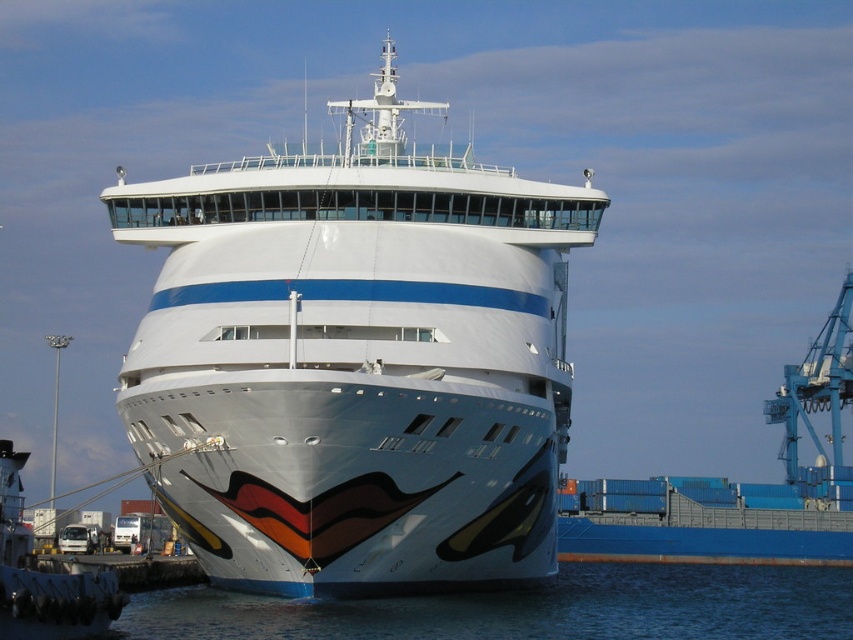
Question: Among these objects, which one is farthest from the camera?

Choices:
 (A) blue water at lower center
 (B) white glossy cruise ship at center

Answer: (A)

Question: Which point is closer to the camera?

Choices:
 (A) (553, 476)
 (B) (103, 593)
 (C) (527, 605)

Answer: (B)

Question: Can you confirm if white glossy cruise ship at center is positioned below blue water at lower center?

Choices:
 (A) yes
 (B) no

Answer: (B)

Question: Does white glossy cruise ship at center have a lesser width compared to white glossy ship at center?

Choices:
 (A) no
 (B) yes

Answer: (A)

Question: Can you confirm if white glossy cruise ship at center is thinner than blue water at lower center?

Choices:
 (A) yes
 (B) no

Answer: (A)

Question: Based on their relative distances, which object is nearer to the white glossy ship at center?

Choices:
 (A) white glossy cruise ship at center
 (B) blue water at lower center

Answer: (A)